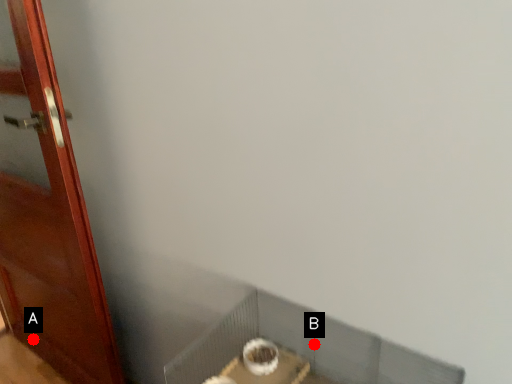
Question: Two points are circled on the image, labeled by A and B beside each circle. Which point is farther to the camera?

Choices:
 (A) A is further
 (B) B is further

Answer: (A)